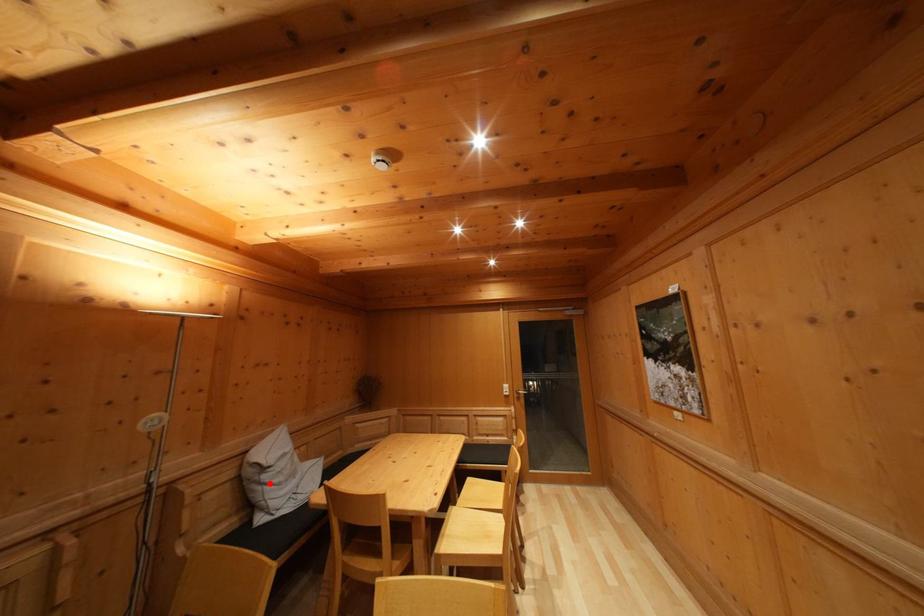
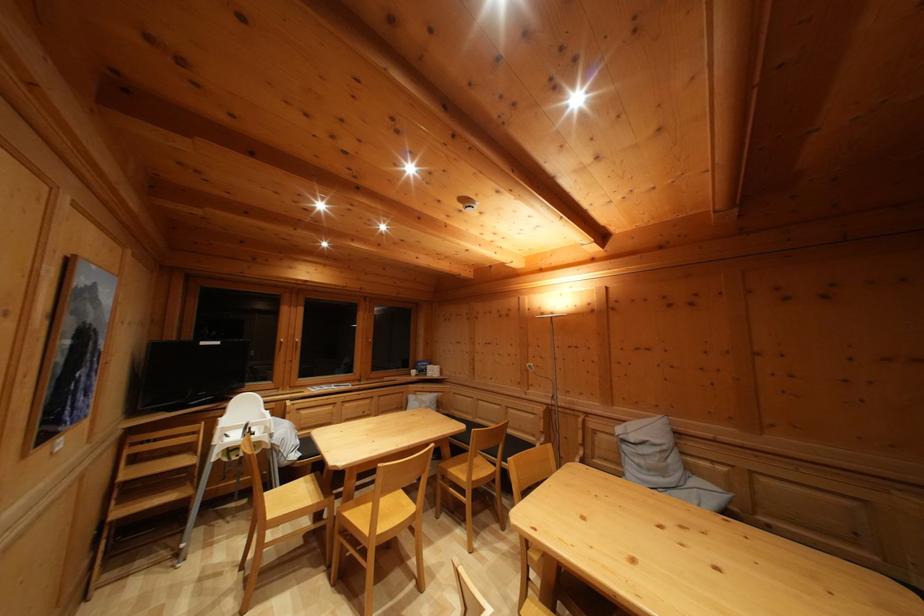
Locate, in the second image, the point that corresponds to the highlighted location in the first image.

(629, 454)